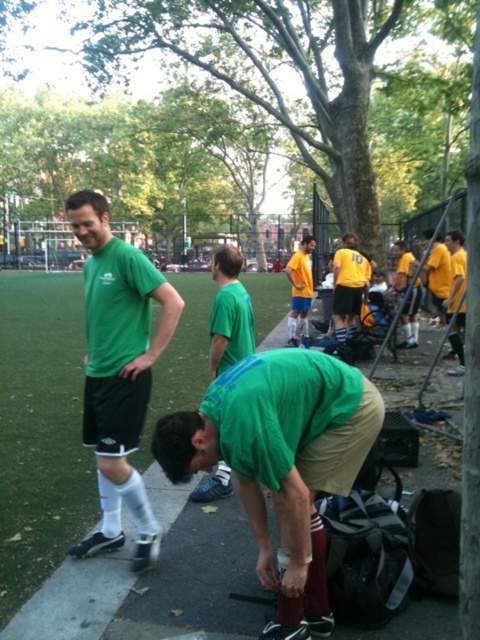
Which is more to the left, yellow jersey at center or yellow matte shirt at center?

yellow jersey at center

Is point (347, 234) positioned in front of point (414, 269)?

Yes, it is.

What do you see at coordinates (348, 284) in the screenshot?
I see `yellow jersey at center` at bounding box center [348, 284].

What are the coordinates of `yellow jersey at center` in the screenshot? It's located at (348, 284).

Between matte yellow jersey at center and yellow matte shirt at right, which one is positioned higher?

matte yellow jersey at center is higher up.

Does matte yellow jersey at center have a lesser height compared to yellow matte shirt at right?

In fact, matte yellow jersey at center may be taller than yellow matte shirt at right.

Does point (298, 262) come behind point (441, 320)?

No, (298, 262) is in front of (441, 320).

The height and width of the screenshot is (640, 480). Identify the location of matte yellow jersey at center. (300, 289).

Does point (340, 285) come closer to viewer compared to point (456, 328)?

No.

How distant is yellow jersey at center from yellow jersey at right?

yellow jersey at center is 1.22 meters away from yellow jersey at right.

Measure the distance between yellow jersey at center and camera.

23.02 feet

Locate an element on the screen. yellow jersey at center is located at coordinates (348, 284).